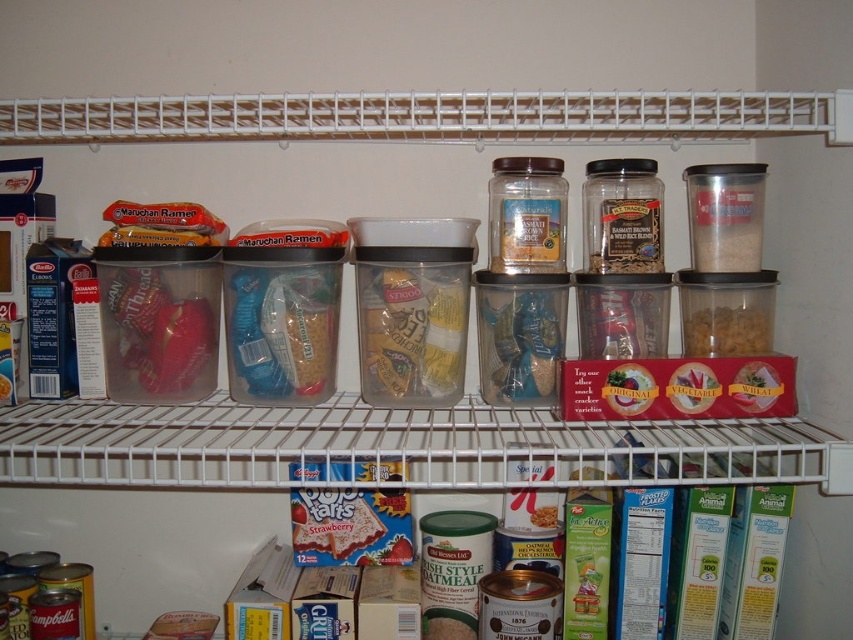
You are organizing the pantry and need to place a new box of cereal that is 4 inches wide. There is space between the clear plastic container at upper right and the brown matte cereal at center right. Can the new cereal box fit in that space?

The space between the clear plastic container at upper right and brown matte cereal at center right is 3.85 inches. Since the new cereal box is 4 inches wide, it cannot fit in that space as the available space is slightly smaller than the box.

You are organizing the pantry and need to place a new item that is 12 inches wide. You have two spaces available between the translucent plastic bag of pasta at center and the translucent glass jar at center. Can both items fit side by side in the space if the total available space is 24 inches?

The translucent plastic bag of pasta at center is wider than the translucent glass jar at center. Since the total available space is 24 inches, and the pasta bag is larger, if the combined width of both items is less than or equal to 24 inches, they can fit. However, without knowing their exact widths, we can only confirm that the pasta bag takes up more space than the jar.

Consider the image. You are organizing the pantry and want to place a new item between the translucent plastic bag of pasta at center and the translucent glass jar at center. Which side should you place it on to keep them in order?

You should place the new item to the right of the translucent plastic bag of pasta at center and to the left of the translucent glass jar at center, maintaining their current left to right order.